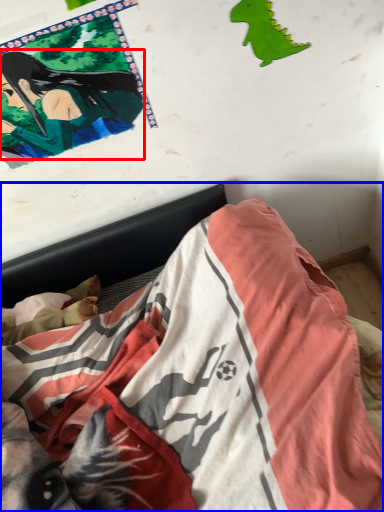
Question: Which object appears farthest to the camera in this image, person (highlighted by a red box) or bed (highlighted by a blue box)?

Choices:
 (A) person
 (B) bed

Answer: (A)